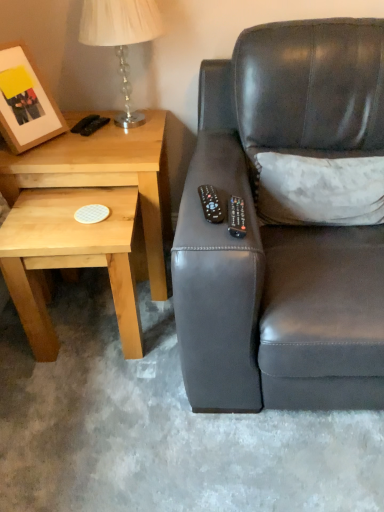
Identify the location of vacant area that lies to the right of wooden matte picture frame at upper left. (72, 150).